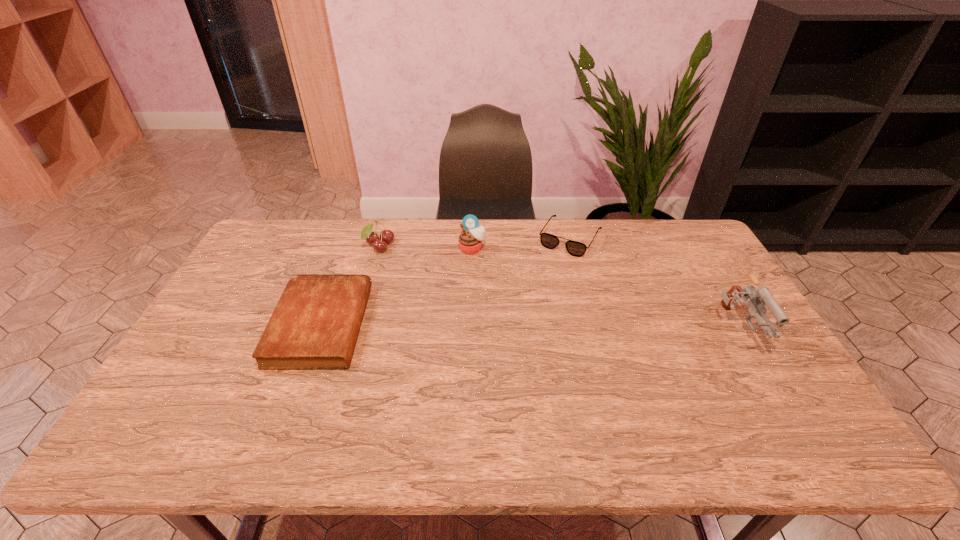
Image resolution: width=960 pixels, height=540 pixels. I want to click on cherry at the far edge, so click(386, 236).

What are the coordinates of `object present at the right edge` in the screenshot? It's located at (761, 296).

I want to click on free space at the far edge, so click(x=329, y=255).

Find the location of a particular element. The width and height of the screenshot is (960, 540). vacant space at the near edge of the desktop is located at coordinates (278, 413).

Image resolution: width=960 pixels, height=540 pixels. In the image, there is a desktop. In order to click on free region at the right edge in this screenshot , I will do `click(676, 271)`.

Locate an element on the screen. vacant space at the far left corner is located at coordinates (283, 228).

This screenshot has width=960, height=540. Find the location of `vacant space at the far right corner`. vacant space at the far right corner is located at coordinates (672, 224).

The height and width of the screenshot is (540, 960). Find the location of `vacant space at the near right corner of the desktop`. vacant space at the near right corner of the desktop is located at coordinates (775, 401).

Identify the location of free space between the tallest object and the second tallest object. The height and width of the screenshot is (540, 960). (603, 289).

The height and width of the screenshot is (540, 960). I want to click on vacant space in between the Bible and the second tallest object, so click(x=396, y=287).